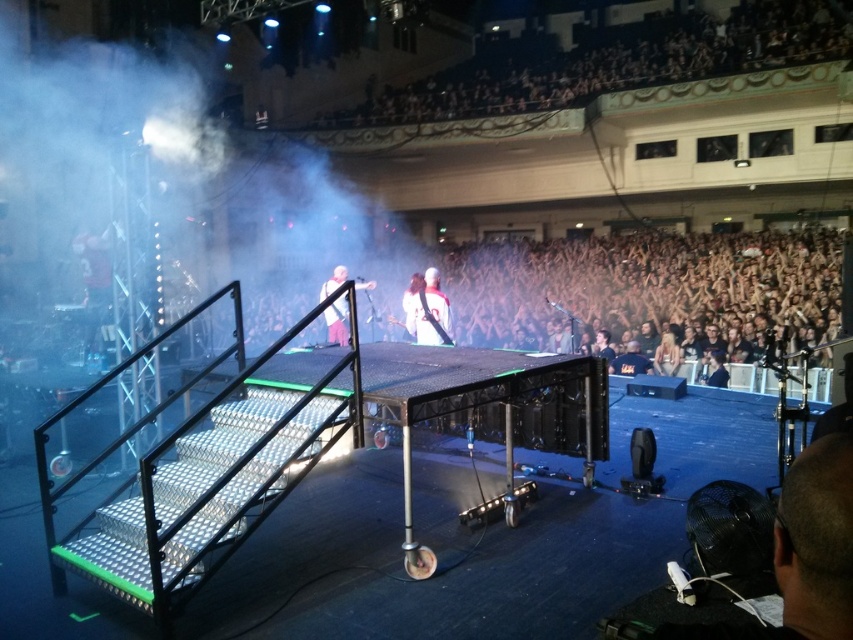
Between white fog at stage center and white fabric guitar at center, which one is positioned higher?

white fog at stage center is above.

Between point (53, 106) and point (345, 275), which one is positioned behind?

Positioned behind is point (53, 106).

Find the location of `white fog at stage center`. white fog at stage center is located at coordinates (97, 152).

Who is more distant from viewer, (450, 333) or (329, 340)?

The point (329, 340) is more distant.

Image resolution: width=853 pixels, height=640 pixels. Describe the element at coordinates (430, 312) in the screenshot. I see `white matte shirt at center` at that location.

Does point (450, 340) come behind point (334, 320)?

No, it is in front of (334, 320).

You are a GUI agent. You are given a task and a screenshot of the screen. Output one action in this format:
    pyautogui.click(x=<x>, y=<y>)
    Task: Click on the white matte shirt at center
    The height and width of the screenshot is (640, 853).
    Given the screenshot: What is the action you would take?
    [430, 312]

You are a GUI agent. You are given a task and a screenshot of the screen. Output one action in this format:
    pyautogui.click(x=<x>, y=<y>)
    Task: Click on the white fog at stage center
    The image size is (853, 640).
    Given the screenshot: What is the action you would take?
    pyautogui.click(x=97, y=152)

Does white fog at stage center come in front of white matte shirt at center?

Yes, it is.

Describe the element at coordinates (97, 152) in the screenshot. I see `white fog at stage center` at that location.

This screenshot has height=640, width=853. I want to click on white fog at stage center, so click(x=97, y=152).